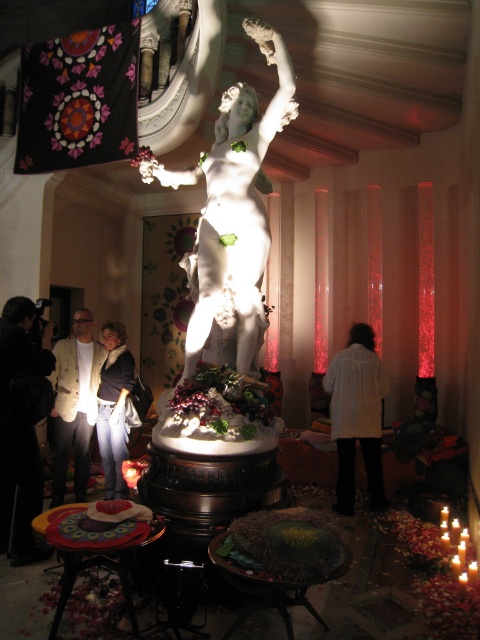
Does black fabric at left lie behind white textured jacket at center?

No, it is in front of white textured jacket at center.

Is point (24, 547) positioned after point (88, 449)?

No, it is not.

You are a GUI agent. You are given a task and a screenshot of the screen. Output one action in this format:
    pyautogui.click(x=<x>, y=<y>)
    Task: Click on the black fabric at left
    The height and width of the screenshot is (640, 480).
    Given the screenshot: What is the action you would take?
    pyautogui.click(x=20, y=428)

Does white textured jacket at center have a greater width compared to jeans at lower left?

Yes.

Does white textured jacket at center have a larger size compared to jeans at lower left?

Yes.

Is point (63, 413) positioned in front of point (104, 467)?

That is False.

This screenshot has height=640, width=480. I want to click on white textured jacket at center, so click(74, 403).

Which is behind, point (363, 333) or point (81, 380)?

Point (81, 380)

Between white matte coat at center and white textured jacket at center, which one has less height?

With less height is white matte coat at center.

This screenshot has width=480, height=640. What do you see at coordinates (357, 416) in the screenshot? I see `white matte coat at center` at bounding box center [357, 416].

This screenshot has height=640, width=480. I want to click on white matte coat at center, so click(x=357, y=416).